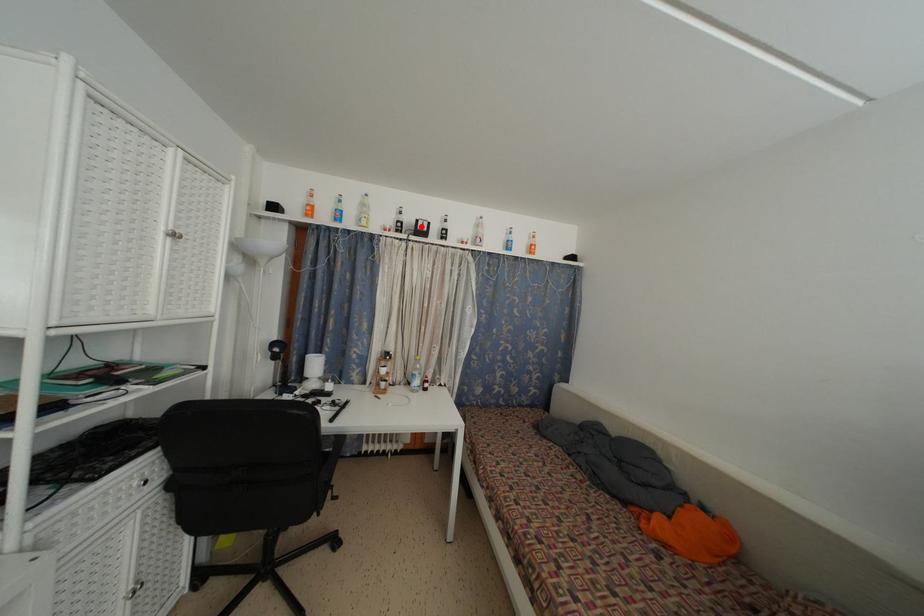
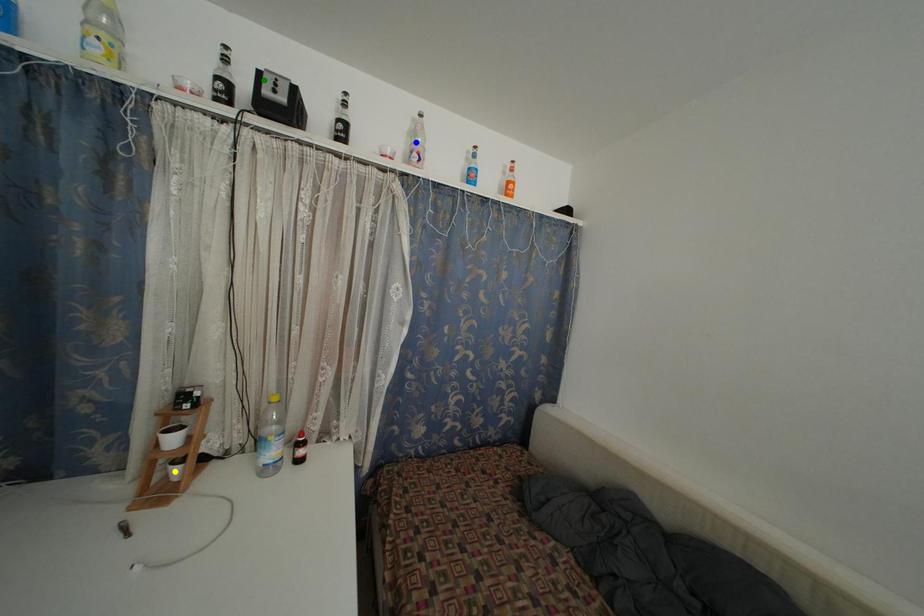
Question: I am providing you with two images of the same scene from different viewpoints. A red point is marked on the first image. You are given multiple points on the second image. Which mark in image 2 goes with the point in image 1?

Choices:
 (A) blue point
 (B) green point
 (C) yellow point

Answer: (B)